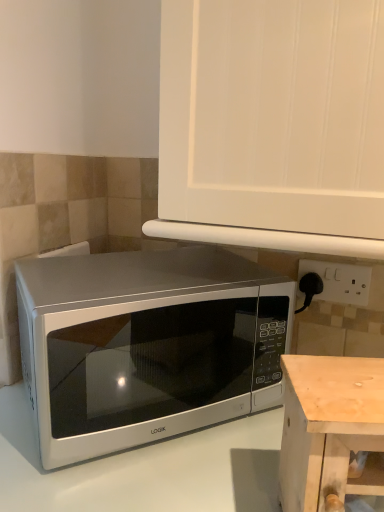
Question: Does white plastic electric outlet at right have a greater height compared to pine wood table at lower right?

Choices:
 (A) yes
 (B) no

Answer: (B)

Question: Is white plastic electric outlet at right to the right of pine wood table at lower right from the viewer's perspective?

Choices:
 (A) yes
 (B) no

Answer: (A)

Question: Is white plastic electric outlet at right smaller than pine wood table at lower right?

Choices:
 (A) yes
 (B) no

Answer: (A)

Question: Considering the relative sizes of white plastic electric outlet at right and pine wood table at lower right in the image provided, is white plastic electric outlet at right thinner than pine wood table at lower right?

Choices:
 (A) yes
 (B) no

Answer: (A)

Question: Are white plastic electric outlet at right and pine wood table at lower right located far from each other?

Choices:
 (A) yes
 (B) no

Answer: (B)

Question: From a real-world perspective, is satin silver microwave at center positioned above or below white glossy microwave at lower left?

Choices:
 (A) above
 (B) below

Answer: (A)

Question: From the image's perspective, relative to white glossy microwave at lower left, is satin silver microwave at center above or below?

Choices:
 (A) below
 (B) above

Answer: (B)

Question: Does point (248, 289) appear closer or farther from the camera than point (226, 483)?

Choices:
 (A) closer
 (B) farther

Answer: (B)

Question: In the image, is satin silver microwave at center positioned in front of or behind white glossy microwave at lower left?

Choices:
 (A) behind
 (B) front

Answer: (A)

Question: Is white matte cabinet at upper center bigger or smaller than white plastic electric outlet at right?

Choices:
 (A) small
 (B) big

Answer: (B)

Question: Considering their positions, is white matte cabinet at upper center located in front of or behind white plastic electric outlet at right?

Choices:
 (A) behind
 (B) front

Answer: (B)

Question: From a real-world perspective, is white matte cabinet at upper center physically located above or below white plastic electric outlet at right?

Choices:
 (A) below
 (B) above

Answer: (B)

Question: Which is correct: white matte cabinet at upper center is inside white plastic electric outlet at right, or outside of it?

Choices:
 (A) outside
 (B) inside

Answer: (A)

Question: Visually, is pine wood table at lower right positioned to the left or to the right of white glossy microwave at lower left?

Choices:
 (A) right
 (B) left

Answer: (A)

Question: Is pine wood table at lower right wider or thinner than white glossy microwave at lower left?

Choices:
 (A) wide
 (B) thin

Answer: (B)